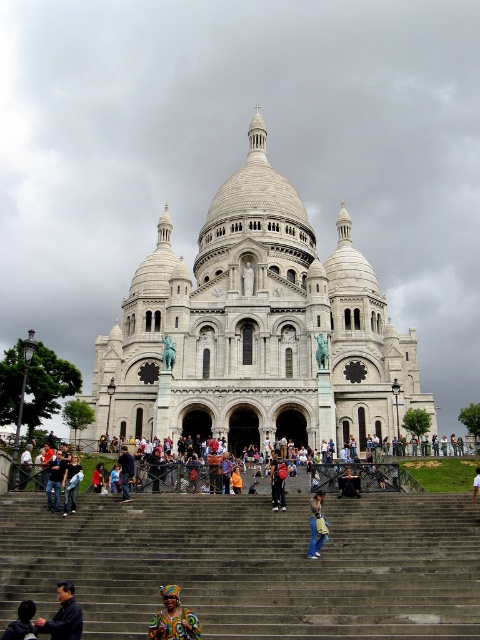
Does white stone church at center appear on the left side of dark blue shirt at lower left?

Incorrect, white stone church at center is not on the left side of dark blue shirt at lower left.

Who is higher up, white stone church at center or dark blue shirt at lower left?

white stone church at center

Is point (208, 420) positioned behind point (72, 588)?

That is True.

Where is `white stone church at center`? This screenshot has width=480, height=640. white stone church at center is located at coordinates (255, 330).

Is concrete stairs at center smaller than dark blue shirt at lower left?

No.

This screenshot has width=480, height=640. What do you see at coordinates (251, 564) in the screenshot?
I see `concrete stairs at center` at bounding box center [251, 564].

Where is `concrete stairs at center`? The image size is (480, 640). concrete stairs at center is located at coordinates (251, 564).

Can you confirm if dark blue fabric jacket at lower left is wider than multicolored fabric bag at center?

In fact, dark blue fabric jacket at lower left might be narrower than multicolored fabric bag at center.

Between point (14, 621) and point (277, 504), which one is positioned in front?

Point (14, 621)

Where is `dark blue fabric jacket at lower left`? dark blue fabric jacket at lower left is located at coordinates (22, 621).